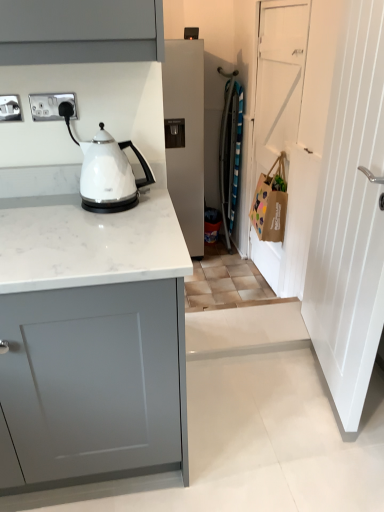
Locate an element on the screen. empty space that is to the right of white marble countertop at center is located at coordinates (254, 426).